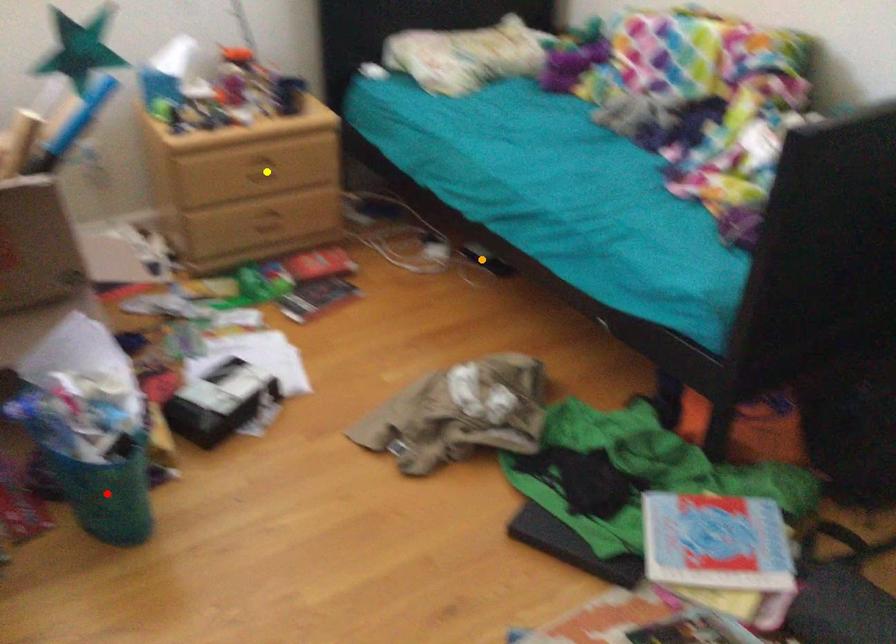
Order these from nearest to farthest:
orange point
red point
yellow point

red point → yellow point → orange point